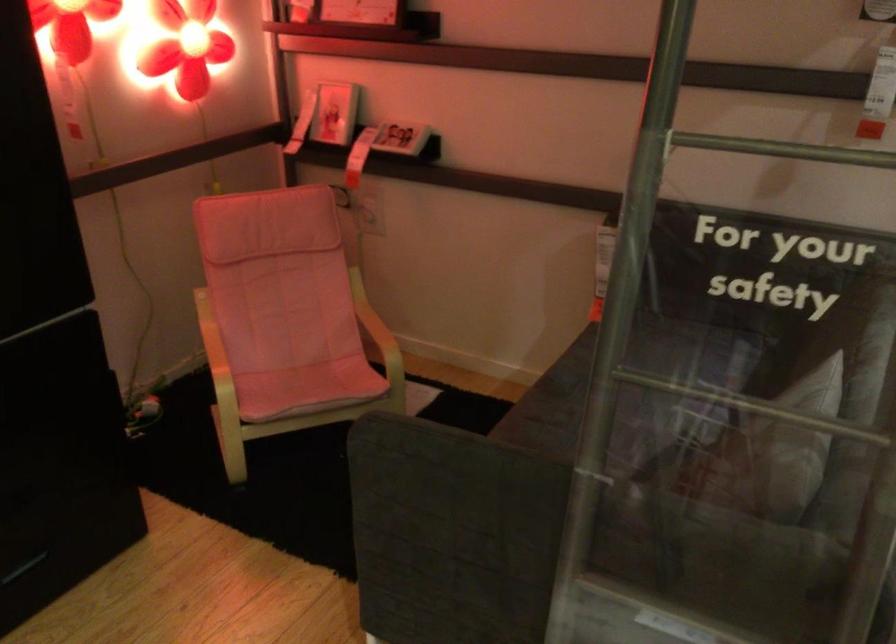
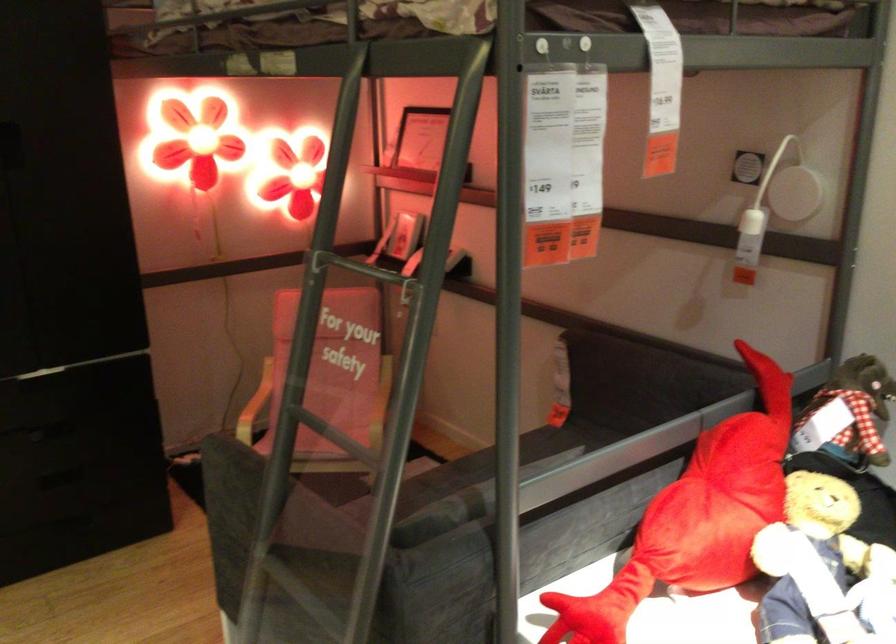
Where in the second image is the point corresponding to [771,420] from the first image?

(340, 448)